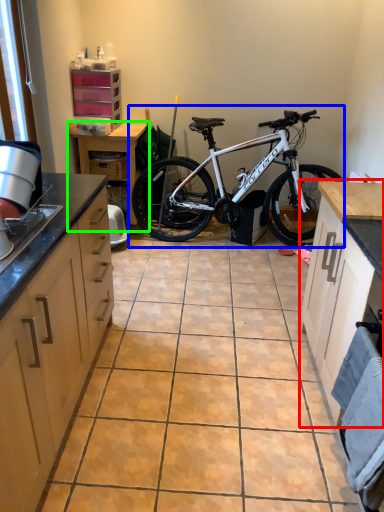
Question: Which object is positioned farthest from cabinetry (highlighted by a red box)? Select from bicycle (highlighted by a blue box) and table (highlighted by a green box).

Choices:
 (A) bicycle
 (B) table

Answer: (B)